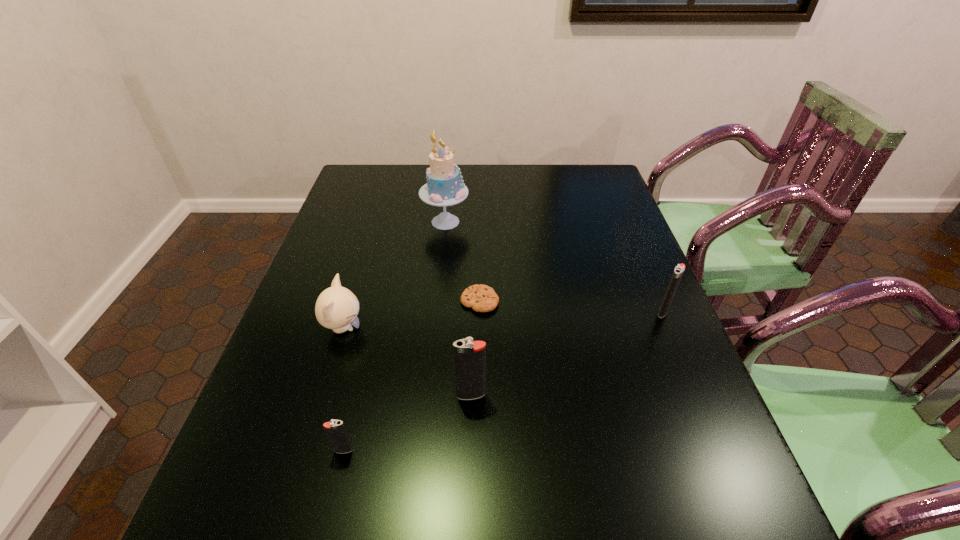
Where is `cookie`? The width and height of the screenshot is (960, 540). cookie is located at coordinates (481, 298).

Where is `vacant space positioned on the right of the nearest object`? This screenshot has height=540, width=960. vacant space positioned on the right of the nearest object is located at coordinates [x=535, y=450].

You are a GUI agent. You are given a task and a screenshot of the screen. Output one action in this format:
    pyautogui.click(x=<x>, y=<y>)
    Task: Click on the vacant space located 0.310m on the back of the second nearest object
    The width and height of the screenshot is (960, 540).
    Given the screenshot: What is the action you would take?
    pyautogui.click(x=472, y=288)

Find the location of `vacant space located 0.340m on the back of the rightmost object`. vacant space located 0.340m on the back of the rightmost object is located at coordinates (627, 226).

Locate an element on the screen. The height and width of the screenshot is (540, 960). vacant region located 0.100m on the face of the third shortest object is located at coordinates (405, 328).

At what (x,y) coordinates should I click in order to perform the action: click on free space located with a ladder on the side of the cake. Please return your answer as a coordinate pair (x, y). Image resolution: width=960 pixels, height=540 pixels. Looking at the image, I should click on (488, 222).

You are a GUI agent. You are given a task and a screenshot of the screen. Output one action in this format:
    pyautogui.click(x=<x>, y=<y>)
    Task: Click on the free point located 0.130m on the right of the shortest object
    The height and width of the screenshot is (540, 960).
    Given the screenshot: What is the action you would take?
    pyautogui.click(x=550, y=301)

At what (x,y) coordinates should I click in order to perform the action: click on object that is positioned at the near edge. Please return your answer as a coordinate pair (x, y). The width and height of the screenshot is (960, 540). Looking at the image, I should click on (336, 432).

Locate an element on the screen. object positioned at the left edge is located at coordinates (336, 308).

Where is `object present at the right edge`? object present at the right edge is located at coordinates (679, 269).